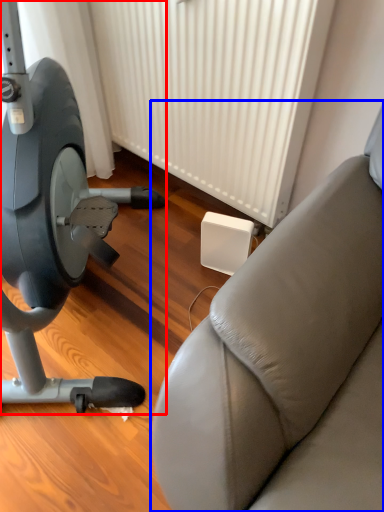
Question: Which of the following is the farthest to the observer, stationary bicycle (highlighted by a red box) or studio couch (highlighted by a blue box)?

Choices:
 (A) stationary bicycle
 (B) studio couch

Answer: (B)